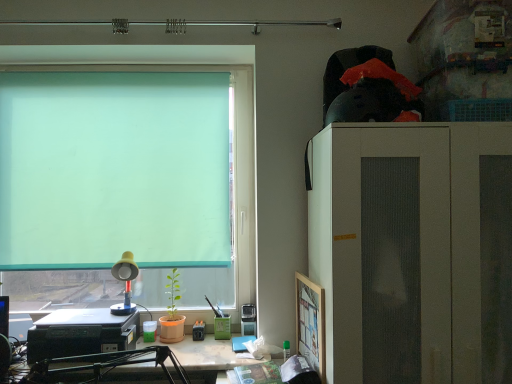
Question: Considering the positions of matte black printer at lower left and green translucent roller at upper left in the image, is matte black printer at lower left wider or thinner than green translucent roller at upper left?

Choices:
 (A) wide
 (B) thin

Answer: (A)

Question: Is matte black printer at lower left to the left or to the right of green translucent roller at upper left in the image?

Choices:
 (A) left
 (B) right

Answer: (B)

Question: Estimate the real-world distances between objects in this image. Which object is closer to the green translucent roller at upper left?

Choices:
 (A) wooden picture frame at right
 (B) yellow plastic lamp at lower left
 (C) white matte cabinet at right
 (D) black plastic printer at lower left
 (E) matte black printer at lower left

Answer: (A)

Question: Considering the real-world distances, which object is closest to the yellow plastic lamp at lower left?

Choices:
 (A) matte black printer at lower left
 (B) wooden picture frame at right
 (C) white matte cabinet at right
 (D) black plastic printer at lower left
 (E) green translucent roller at upper left

Answer: (D)